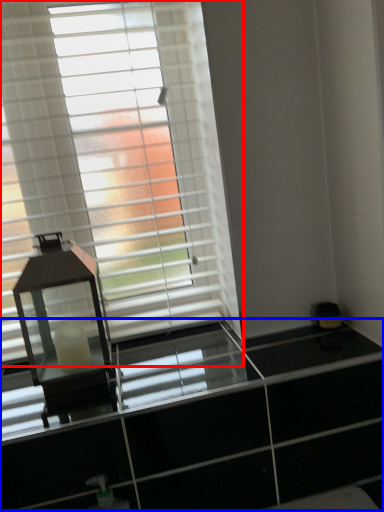
Question: Among these objects, which one is farthest to the camera, window blind (highlighted by a red box) or dresser (highlighted by a blue box)?

Choices:
 (A) window blind
 (B) dresser

Answer: (A)